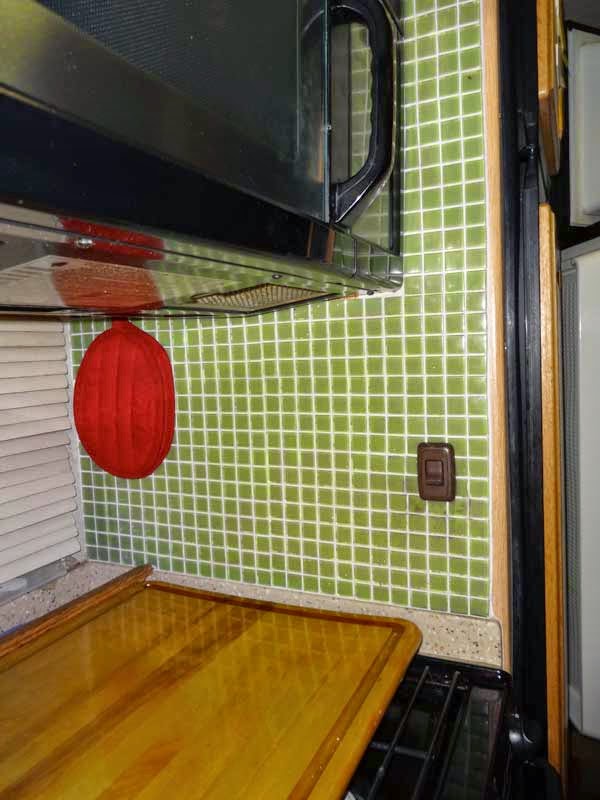
Image resolution: width=600 pixels, height=800 pixels. I want to click on light switch, so click(432, 472).